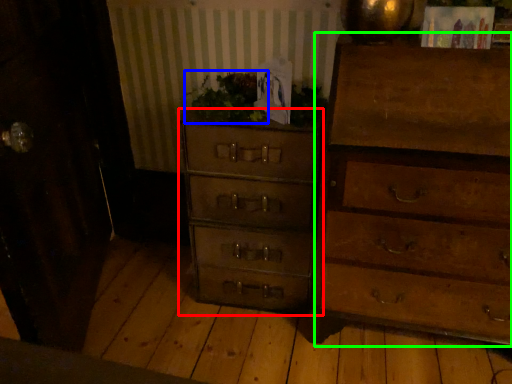
Question: Which object is the farthest from chest of drawers (highlighted by a red box)? Choose among these: houseplant (highlighted by a blue box) or chest of drawers (highlighted by a green box).

Choices:
 (A) houseplant
 (B) chest of drawers

Answer: (B)